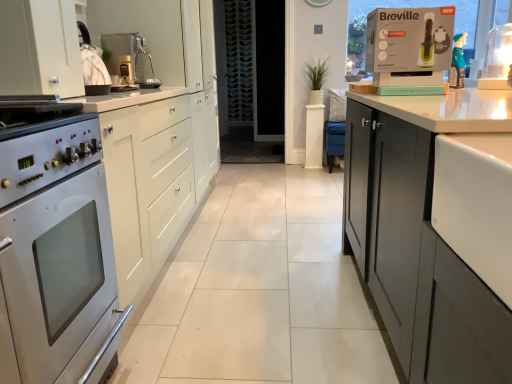
Measure the distance between matte white box at upper right and camera.

The distance of matte white box at upper right from camera is 3.55 meters.

The image size is (512, 384). In order to click on metallic silver coffee machine at upper center in this screenshot , I will do `click(129, 59)`.

Image resolution: width=512 pixels, height=384 pixels. What do you see at coordinates (56, 253) in the screenshot? I see `satin silver oven at left` at bounding box center [56, 253].

At what (x,y) coordinates should I click in order to perform the action: click on white matte cabinet at left. Please return your answer as a coordinate pair (x, y). This screenshot has height=384, width=512. Looking at the image, I should click on (157, 132).

The height and width of the screenshot is (384, 512). Describe the element at coordinates (157, 132) in the screenshot. I see `white matte cabinet at left` at that location.

Find the location of a particular element. The image size is (512, 384). matte white box at upper right is located at coordinates coord(406,7).

Which of these two, white glossy lamp at upper right or white matte cabinet at left, is smaller?

white glossy lamp at upper right.

Can you confirm if white glossy lamp at upper right is thinner than white matte cabinet at left?

Yes.

Between white glossy lamp at upper right and white matte cabinet at left, which one has less height?

white glossy lamp at upper right.

Between white glossy lamp at upper right and white matte cabinet at left, which one appears on the right side from the viewer's perspective?

white glossy lamp at upper right is more to the right.

Which of these two, matte white box at upper right or white matte cabinet at left, stands taller?

white matte cabinet at left is taller.

Would you say matte white box at upper right is inside or outside white matte cabinet at left?

matte white box at upper right is outside white matte cabinet at left.

Considering the relative sizes of matte white box at upper right and white matte cabinet at left in the image provided, is matte white box at upper right thinner than white matte cabinet at left?

Yes, matte white box at upper right is thinner than white matte cabinet at left.

Considering the relative sizes of matte white box at upper right and white glossy lamp at upper right in the image provided, is matte white box at upper right taller than white glossy lamp at upper right?

In fact, matte white box at upper right may be shorter than white glossy lamp at upper right.

Is matte white box at upper right turned away from white glossy lamp at upper right?

No, matte white box at upper right is not facing away from white glossy lamp at upper right.

Which of these two, matte white box at upper right or white glossy lamp at upper right, is bigger?

white glossy lamp at upper right is bigger.

Looking at this image, in the image, is matte white box at upper right on the left side or the right side of white glossy lamp at upper right?

A: matte white box at upper right is positioned on white glossy lamp at upper right's left side.

Does white glossy lamp at upper right have a greater width compared to satin silver oven at left?

No, white glossy lamp at upper right is not wider than satin silver oven at left.

Based on the photo, who is taller, white glossy lamp at upper right or satin silver oven at left?

satin silver oven at left.

Looking at this image, is white glossy lamp at upper right facing away from satin silver oven at left?

No, satin silver oven at left is not at the back of white glossy lamp at upper right.

In the scene shown: Between white glossy lamp at upper right and matte white box at upper right, which one has smaller width?

white glossy lamp at upper right is thinner.

The width and height of the screenshot is (512, 384). In order to click on appliance that appears on the right of matte white box at upper right in this screenshot , I will do `click(497, 59)`.

Is point (487, 87) closer or farther from the camera than point (455, 10)?

Point (487, 87) is closer to the camera than point (455, 10).

In the scene shown: Which point is more forward, (x=39, y=32) or (x=366, y=70)?

Point (x=39, y=32)

From the image's perspective, which is above, white matte cabinet at left or matte white box at upper right?

matte white box at upper right is shown above in the image.

Is white matte cabinet at left far away from matte white box at upper right?

Absolutely, white matte cabinet at left is distant from matte white box at upper right.

Looking at this image, is white matte cabinet at left looking in the opposite direction of matte white box at upper right?

No, white matte cabinet at left's orientation is not away from matte white box at upper right.

Can you confirm if matte white box at upper right is wider than satin silver oven at left?

No.

In the scene shown: Is matte white box at upper right to the right of satin silver oven at left from the viewer's perspective?

Yes, matte white box at upper right is to the right of satin silver oven at left.

From a real-world perspective, is matte white box at upper right positioned above or below satin silver oven at left?

matte white box at upper right is situated higher than satin silver oven at left in the real world.

From the image's perspective, is matte white box at upper right located above satin silver oven at left?

Yes, from the image's perspective, matte white box at upper right is above satin silver oven at left.

The height and width of the screenshot is (384, 512). What are the coordinates of `appliance behind the white matte cabinet at left` in the screenshot? It's located at (497, 59).

You are a GUI agent. You are given a task and a screenshot of the screen. Output one action in this format:
    pyautogui.click(x=<x>, y=<y>)
    Task: Click on the cabinetry located in front of the matte white box at upper right
    This screenshot has width=512, height=384.
    Given the screenshot: What is the action you would take?
    pyautogui.click(x=157, y=132)

Based on their spatial positions, is white glossy lamp at upper right or metallic silver coffee machine at upper center further from satin silver oven at left?

white glossy lamp at upper right.

Considering their positions, is metallic silver coffee machine at upper center positioned further to white glossy countertop at right than white matte cabinet at left?

metallic silver coffee machine at upper center lies further to white glossy countertop at right than the other object.

Which object lies nearer to the anchor point matte white box at upper right, white glossy countertop at right or metallic silver coffee machine at upper center?

metallic silver coffee machine at upper center is closer to matte white box at upper right.

Estimate the real-world distances between objects in this image. Which object is closer to satin silver oven at left, matte white box at upper right or white glossy countertop at right?

The object closer to satin silver oven at left is white glossy countertop at right.

From the image, which object appears to be farther from matte white box at upper right, satin silver oven at left or white glossy countertop at right?

satin silver oven at left.

Which object lies further to the anchor point metallic silver coffee machine at upper center, white glossy lamp at upper right or matte white box at upper right?

The object further to metallic silver coffee machine at upper center is white glossy lamp at upper right.

Estimate the real-world distances between objects in this image. Which object is further from satin silver oven at left, white matte cabinet at left or metallic silver coffee machine at upper center?

metallic silver coffee machine at upper center lies further to satin silver oven at left than the other object.

Estimate the real-world distances between objects in this image. Which object is further from white matte cabinet at left, metallic silver coffee machine at upper center or matte white box at upper right?

matte white box at upper right lies further to white matte cabinet at left than the other object.

Locate an element on the screen. The height and width of the screenshot is (384, 512). window screen located between satin silver oven at left and white glossy lamp at upper right in the left-right direction is located at coordinates (406, 7).

Locate an element on the screen. home appliance between white glossy countertop at right and metallic silver coffee machine at upper center in the front-back direction is located at coordinates [x=56, y=253].

Where is `counter top between metallic silver coffee machine at upper center and white glossy lamp at upper right in the horizontal direction`? counter top between metallic silver coffee machine at upper center and white glossy lamp at upper right in the horizontal direction is located at coordinates (476, 204).

I want to click on cabinetry between satin silver oven at left and white glossy lamp at upper right, so click(157, 132).